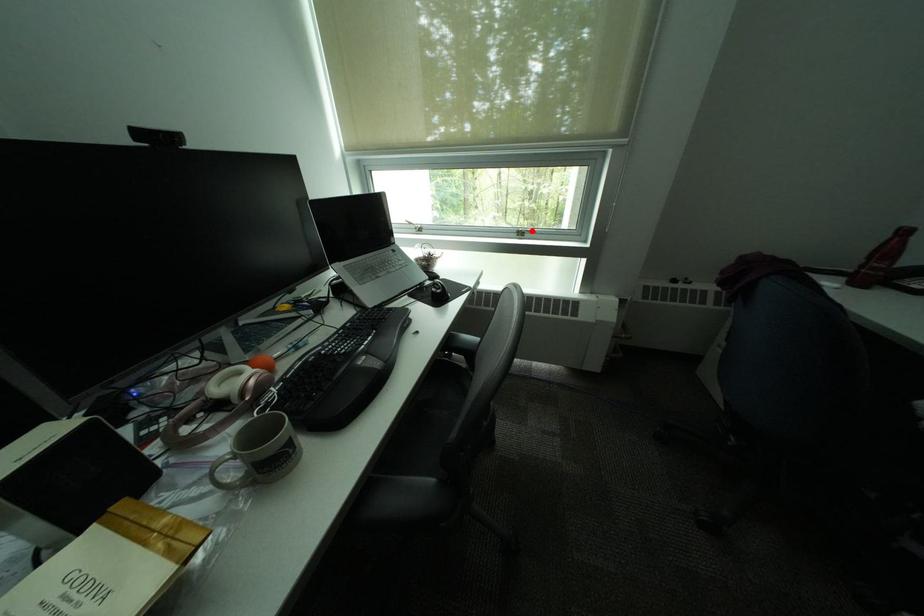
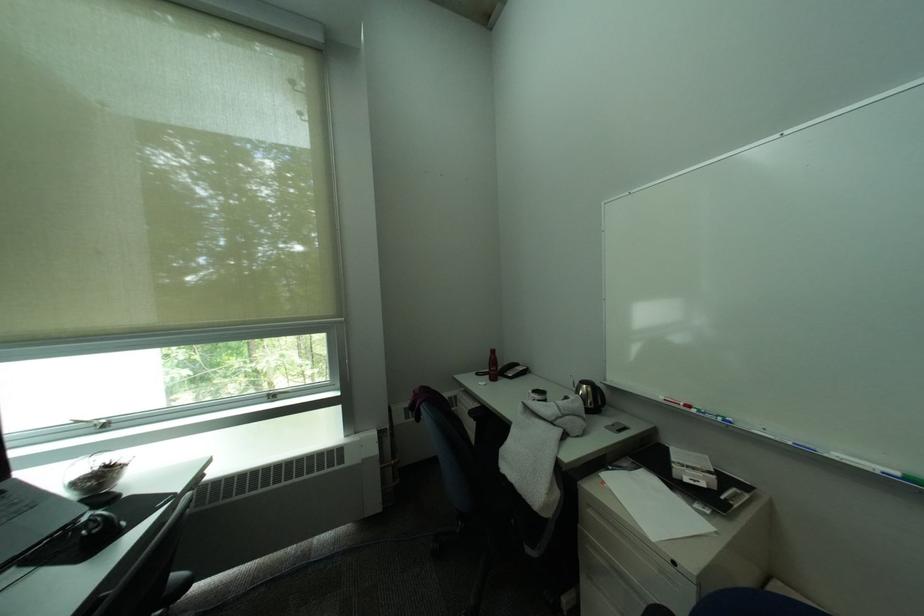
The point at the highlighted location is marked in the first image. Where is the corresponding point in the second image?

(283, 392)